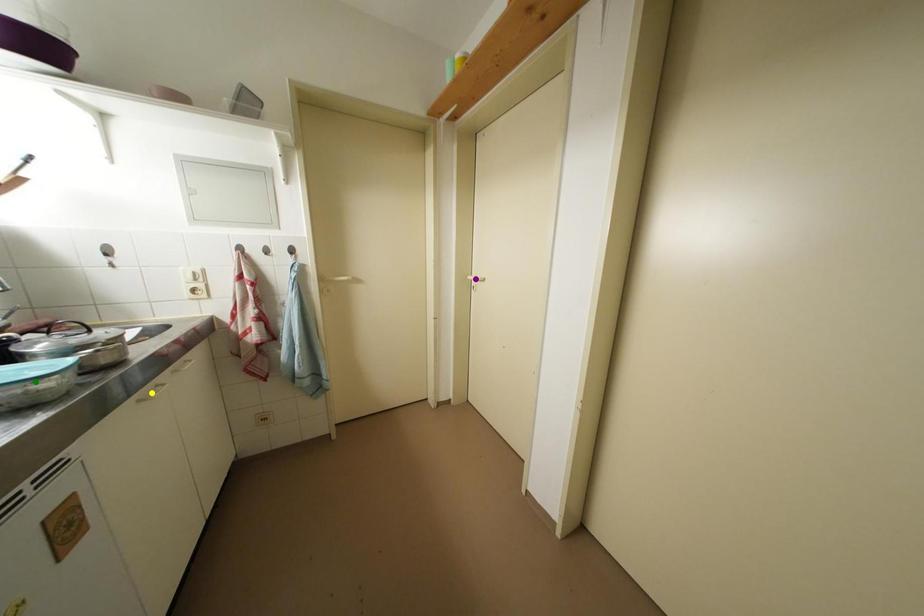
Order these from nearest to farthest:
purple point | yellow point | green point

green point < yellow point < purple point